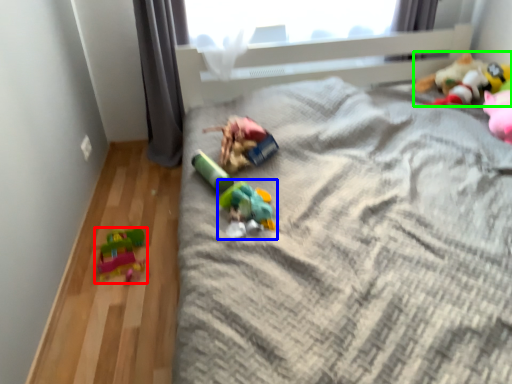
Question: Considering the real-world distances, which object is farthest from toy (highlighted by a red box)? toy (highlighted by a blue box) or toy (highlighted by a green box)?

Choices:
 (A) toy
 (B) toy

Answer: (B)